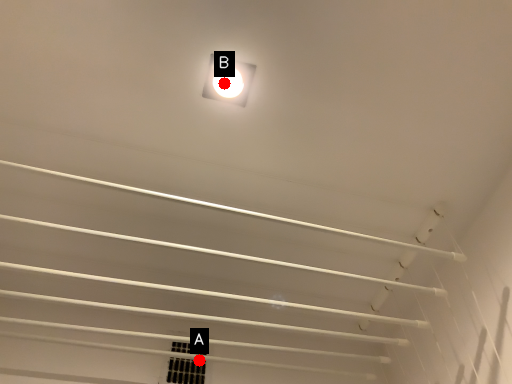
Question: Two points are circled on the image, labeled by A and B beside each circle. Which point is closer to the camera?

Choices:
 (A) A is closer
 (B) B is closer

Answer: (B)